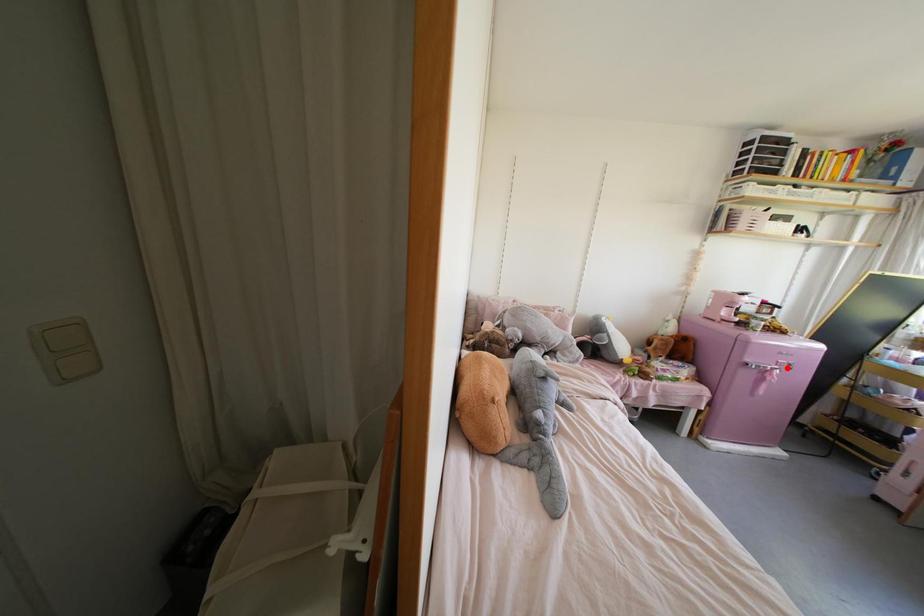
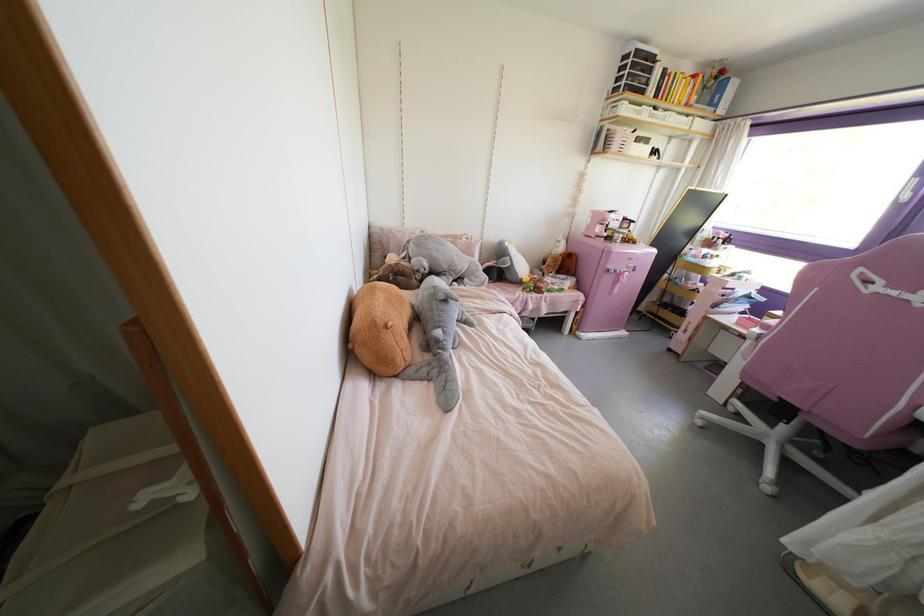
Question: I am providing you with two images of the same scene from different viewpoints. A red point is marked on the first image. Is the red point's position out of view in image 2?

Choices:
 (A) Yes
 (B) No

Answer: (B)